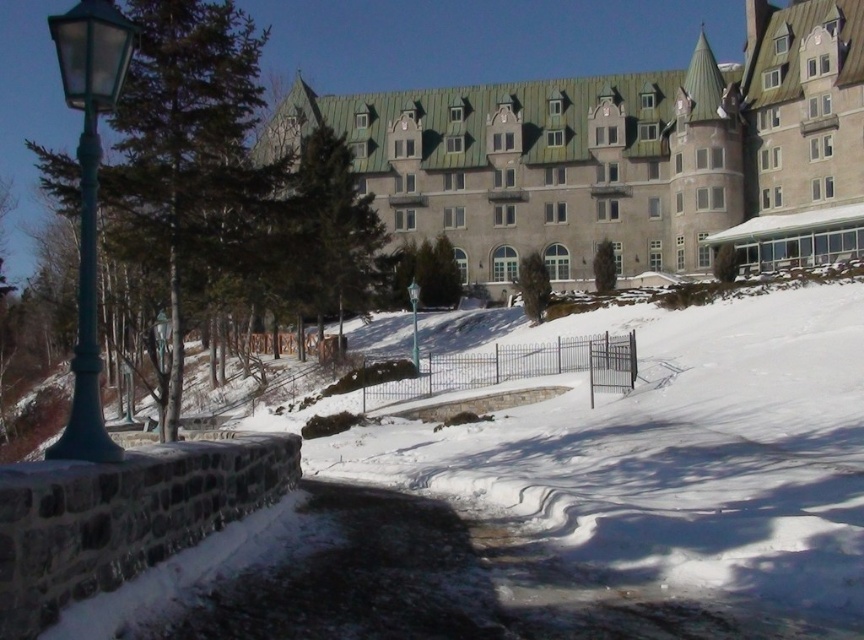
You are a photographer planning to capture the gray stone hotel at center and the green glass lamp post at left in a single shot. Based on their widths, which object should you position closer to the center of the frame to ensure both fit within the camera view?

Since the gray stone hotel at center is narrower than the green glass lamp post at left, you should position the gray stone hotel at center closer to the center of the frame to ensure both fit within the camera view.